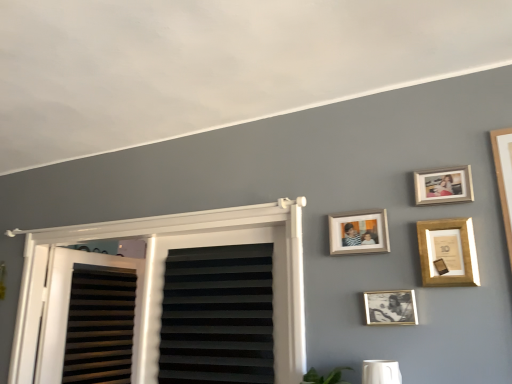
Question: Would you say wooden photo frame at upper center, the 2th picture frame from the top, is to the left or to the right of wooden photo frame at upper right, the fourth picture frame positioned from the bottom, in the picture?

Choices:
 (A) right
 (B) left

Answer: (B)

Question: Is wooden photo frame at upper center, the 3th picture frame in the bottom-to-top sequence, wider or thinner than wooden photo frame at upper right, arranged as the first picture frame when viewed from the top?

Choices:
 (A) wide
 (B) thin

Answer: (A)

Question: Considering the real-world distances, which object is closest to the white plastic window at upper left?

Choices:
 (A) wooden photo frame at upper right, the fourth picture frame positioned from the bottom
 (B) black/gold photo frame at center, the fourth picture frame in the top-to-bottom sequence
 (C) wooden picture frame at upper right, which is counted as the 2th picture frame, starting from the bottom
 (D) wooden photo frame at upper center, the 2th picture frame from the top

Answer: (D)

Question: Which object is positioned closest to the black/gold photo frame at center, the fourth picture frame in the top-to-bottom sequence?

Choices:
 (A) wooden photo frame at upper right, arranged as the first picture frame when viewed from the top
 (B) white plastic window at upper left
 (C) wooden picture frame at upper right, the third picture frame from the top
 (D) wooden photo frame at upper center, the 2th picture frame from the top

Answer: (C)